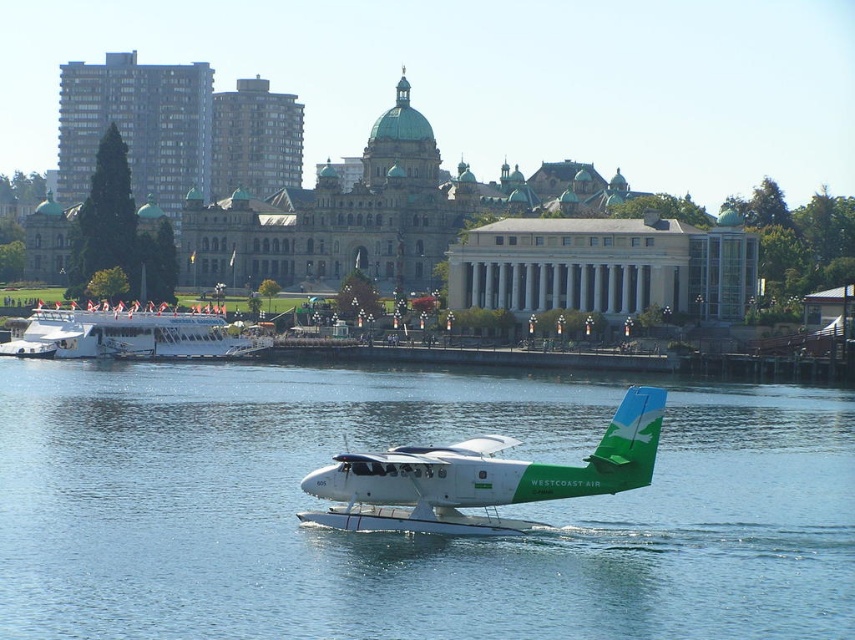
Question: Where is white glossy seaplane at center located in relation to white glossy boat at left in the image?

Choices:
 (A) right
 (B) left

Answer: (A)

Question: Based on their relative distances, which object is farther from the blue water at center?

Choices:
 (A) white glossy boat at left
 (B) white glossy seaplane at center

Answer: (B)

Question: Where is white glossy seaplane at center located in relation to white glossy boat at left in the image?

Choices:
 (A) left
 (B) right

Answer: (B)

Question: Does white glossy seaplane at center appear on the left side of white glossy boat at left?

Choices:
 (A) no
 (B) yes

Answer: (A)

Question: Which of the following is the closest to the observer?

Choices:
 (A) (48, 330)
 (B) (620, 632)
 (C) (624, 486)

Answer: (B)

Question: Among these points, which one is farthest from the camera?

Choices:
 (A) (632, 444)
 (B) (714, 628)

Answer: (A)